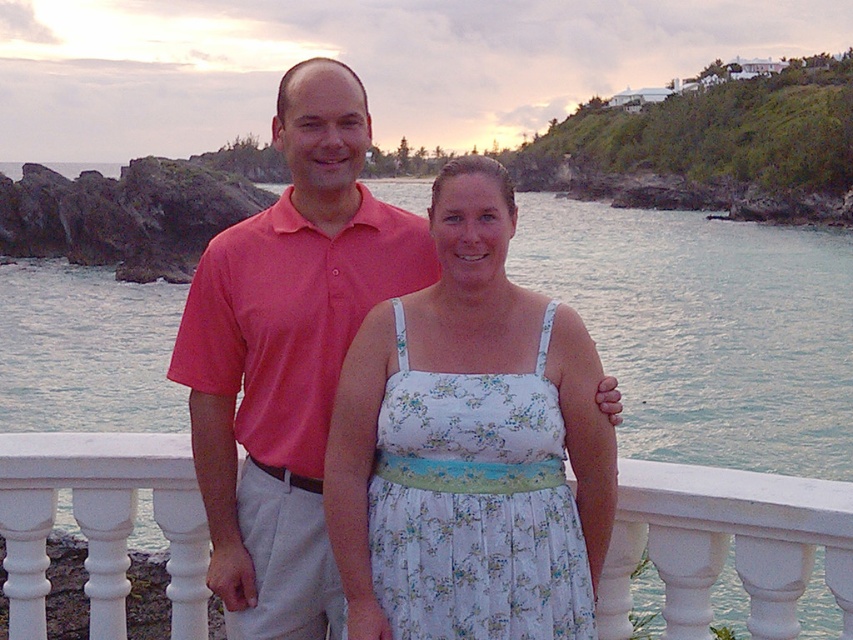
Which is below, pink cotton shirt at upper left or floral cotton dress at center?

floral cotton dress at center

Does pink cotton shirt at upper left appear on the right side of floral cotton dress at center?

In fact, pink cotton shirt at upper left is to the left of floral cotton dress at center.

Between point (254, 410) and point (438, 404), which one is positioned in front?

Point (438, 404)

Where is `pink cotton shirt at upper left`? Image resolution: width=853 pixels, height=640 pixels. pink cotton shirt at upper left is located at coordinates (287, 355).

Image resolution: width=853 pixels, height=640 pixels. Identify the location of white plastic railing at center. (726, 545).

In the scene shown: Who is positioned more to the right, white plastic railing at center or floral cotton dress at center?

From the viewer's perspective, floral cotton dress at center appears more on the right side.

I want to click on white plastic railing at center, so click(x=726, y=545).

Image resolution: width=853 pixels, height=640 pixels. Find the location of `white plastic railing at center`. white plastic railing at center is located at coordinates (726, 545).

Can you confirm if clear water at center is positioned to the left of floral cotton dress at center?

In fact, clear water at center is to the right of floral cotton dress at center.

Does point (24, 384) lie in front of point (456, 541)?

No, (24, 384) is behind (456, 541).

Where is `clear water at center`? Image resolution: width=853 pixels, height=640 pixels. clear water at center is located at coordinates (706, 330).